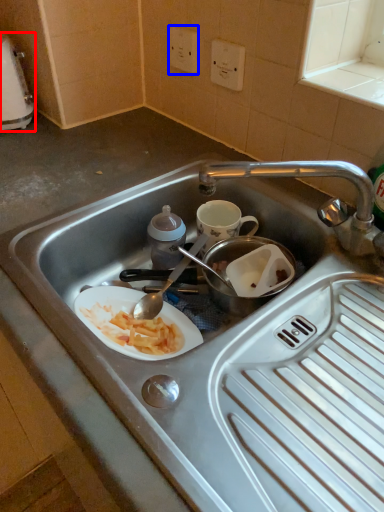
Question: Which object is further to the camera taking this photo, appliance (highlighted by a red box) or electric outlet (highlighted by a blue box)?

Choices:
 (A) appliance
 (B) electric outlet

Answer: (B)